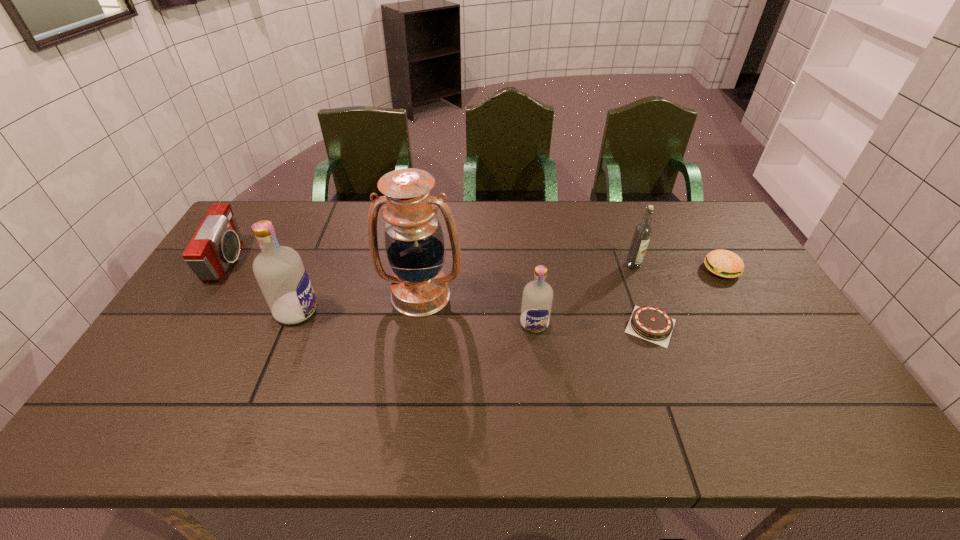
Locate an element on the screen. Image resolution: width=960 pixels, height=540 pixels. patty is located at coordinates (723, 263).

You are a GUI agent. You are given a task and a screenshot of the screen. Output one action in this format:
    pyautogui.click(x=<x>, y=<y>)
    Task: Click on the blank area located on the label of the tallest vodka
    This screenshot has height=540, width=960.
    Given the screenshot: What is the action you would take?
    pyautogui.click(x=349, y=311)

Locate an element on the screen. This screenshot has height=540, width=960. vacant space positioned on the label of the fourth object from right to left is located at coordinates (540, 368).

The width and height of the screenshot is (960, 540). What are the coordinates of `vacant space situated on the label of the farthest vodka` in the screenshot? It's located at (656, 324).

Locate an element on the screen. This screenshot has height=540, width=960. vacant space located 0.340m on the front-facing side of the leftmost object is located at coordinates (347, 262).

Locate an element on the screen. free space located 0.200m on the left of the oil lamp is located at coordinates point(312,295).

The height and width of the screenshot is (540, 960). I want to click on free space located 0.220m on the back of the chocolate cake, so 625,256.

This screenshot has height=540, width=960. What are the coordinates of `free region located 0.120m on the front of the sixth tallest object` in the screenshot? It's located at point(746,311).

Identify the location of object situated at the far edge. (216, 244).

The image size is (960, 540). I want to click on object at the left edge, so click(x=216, y=244).